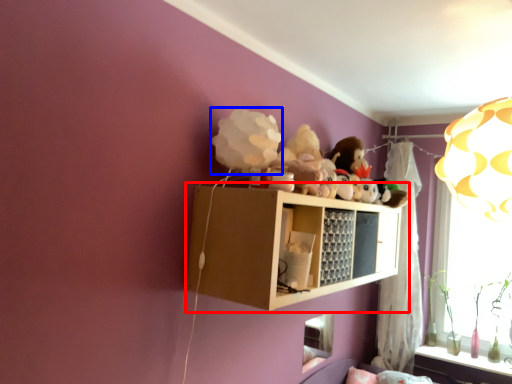
Question: Which point is further to the camera, shelf (highlighted by a red box) or toy (highlighted by a blue box)?

Choices:
 (A) shelf
 (B) toy

Answer: (B)